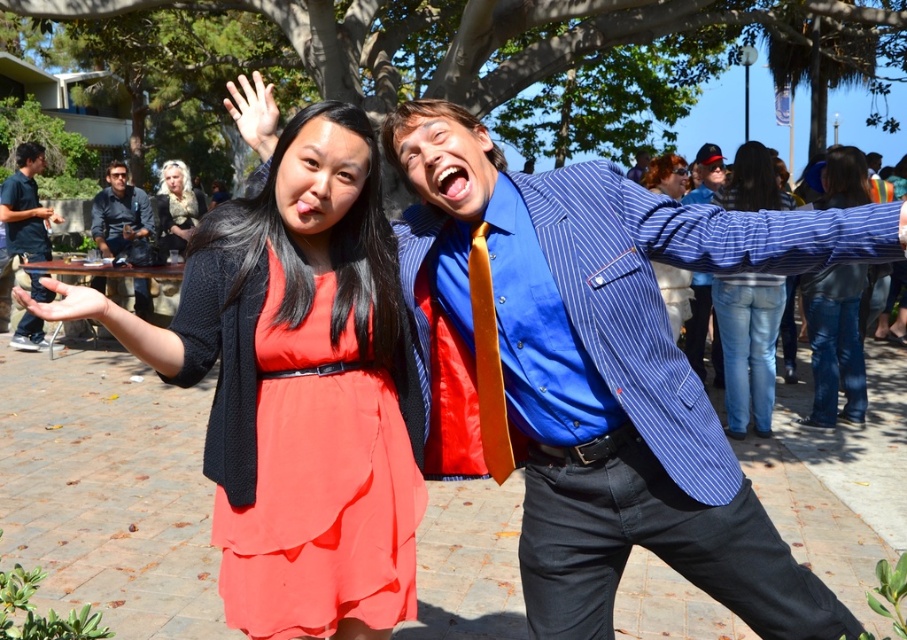
Question: Does orange silk tie at center have a smaller size compared to matte black hair at upper center?

Choices:
 (A) no
 (B) yes

Answer: (B)

Question: Can you confirm if jeans at center is smaller than matte black shirt at left?

Choices:
 (A) yes
 (B) no

Answer: (B)

Question: Is jeans at right below matte black jacket at upper left?

Choices:
 (A) no
 (B) yes

Answer: (B)

Question: Which point is farther to the camera?

Choices:
 (A) matte black sweater at center
 (B) blue striped blazer at center
 (C) jeans at right

Answer: (C)

Question: Considering the real-world distances, which object is farthest from the orange silk tie at center?

Choices:
 (A) matte black jacket at upper left
 (B) blonde hair with light brown highlights at upper left
 (C) matte black shirt at left
 (D) matte black hair at upper center

Answer: (C)

Question: Which of the following is the closest to the observer?

Choices:
 (A) matte black jacket at upper left
 (B) orange silk tie at center
 (C) matte black hair at upper center

Answer: (B)